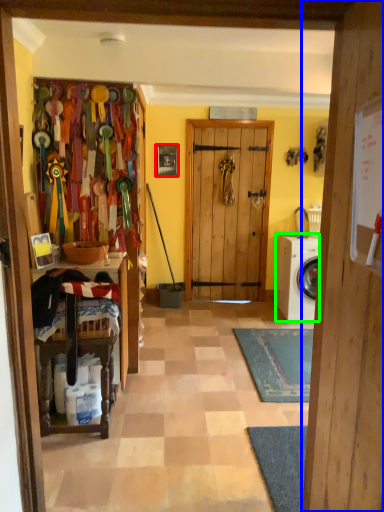
Question: Considering the real-world distances, which object is closest to picture frame (highlighted by a red box)? door (highlighted by a blue box) or washing machine (highlighted by a green box).

Choices:
 (A) door
 (B) washing machine

Answer: (B)